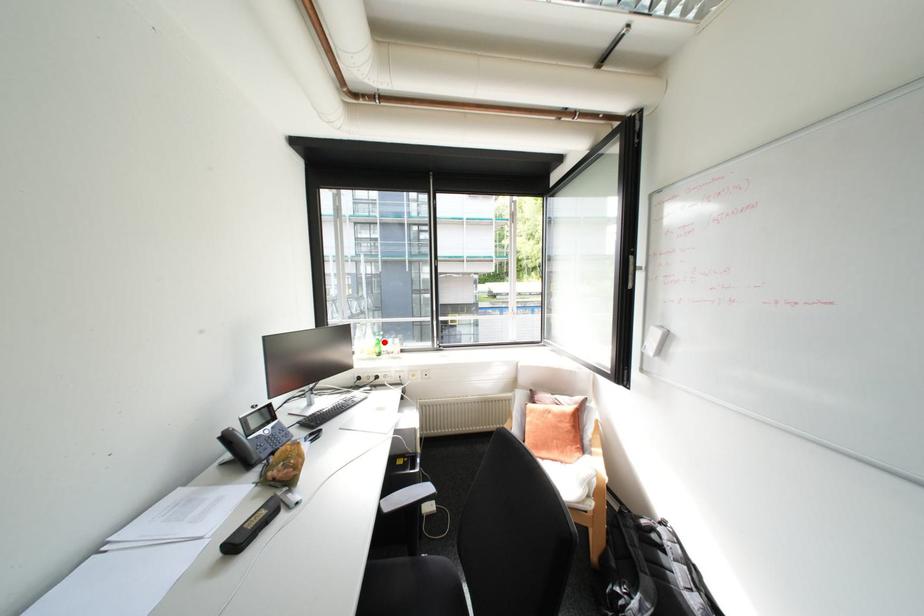
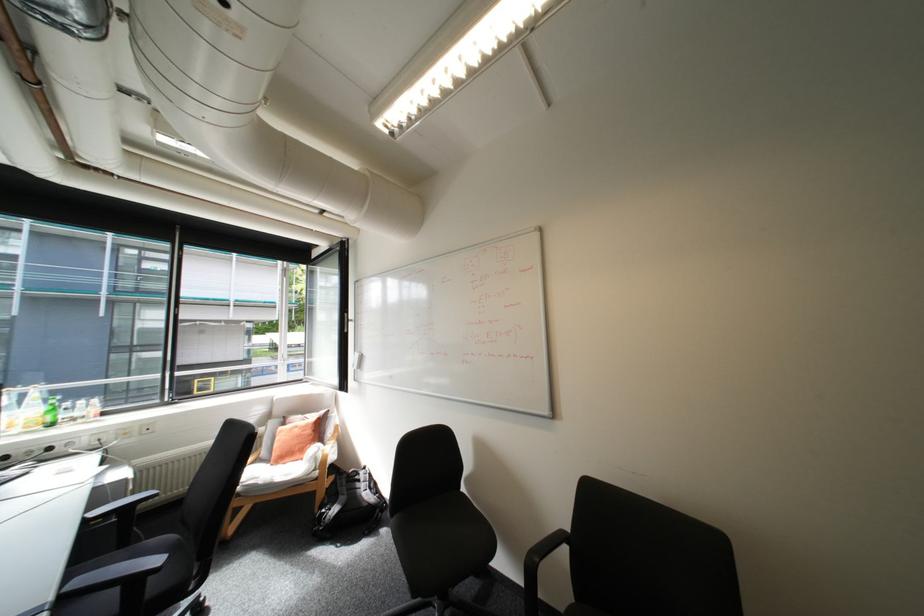
Question: I am providing you with two images of the same scene from different viewpoints. A red point is marked on the first image. Can you still see the location of the red point in image 2?

Choices:
 (A) Yes
 (B) No

Answer: (A)